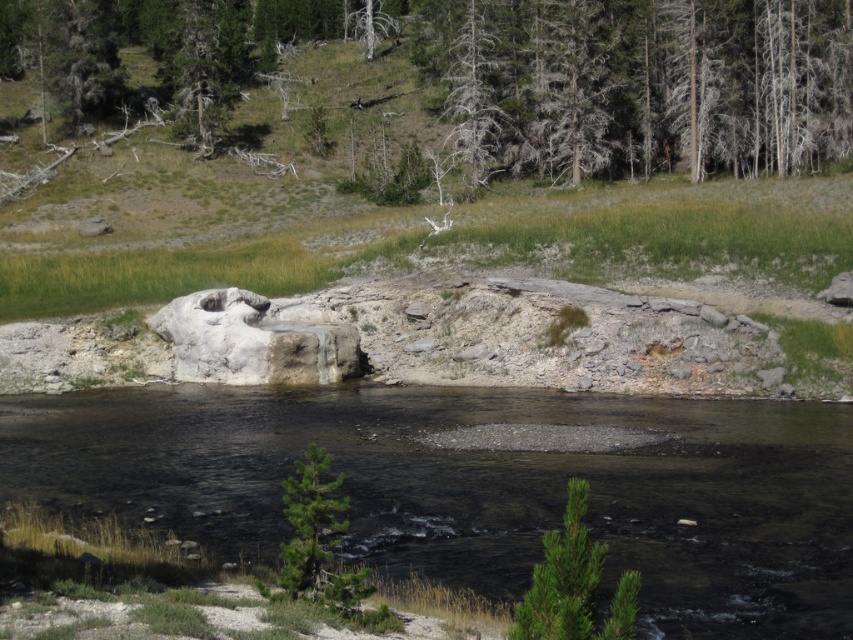
Who is higher up, clear water at center or dead wood at upper center?

Positioned higher is dead wood at upper center.

Who is shorter, clear water at center or dead wood at upper center?

With less height is clear water at center.

What do you see at coordinates (480, 488) in the screenshot? I see `clear water at center` at bounding box center [480, 488].

What are the coordinates of `clear water at center` in the screenshot? It's located at (480, 488).

Which is in front, point (595, 589) or point (341, 588)?

Point (595, 589) is more forward.

The height and width of the screenshot is (640, 853). What do you see at coordinates (573, 584) in the screenshot? I see `green matte tree at lower right` at bounding box center [573, 584].

Image resolution: width=853 pixels, height=640 pixels. In order to click on green matte tree at lower right in this screenshot , I will do `click(573, 584)`.

Does clear water at center have a greater height compared to gray textured tree at upper center?

No, clear water at center is not taller than gray textured tree at upper center.

Measure the distance between clear water at center and gray textured tree at upper center.

The distance of clear water at center from gray textured tree at upper center is 150.31 feet.

Where is `clear water at center`? Image resolution: width=853 pixels, height=640 pixels. clear water at center is located at coordinates (480, 488).

The width and height of the screenshot is (853, 640). In order to click on clear water at center in this screenshot , I will do pos(480,488).